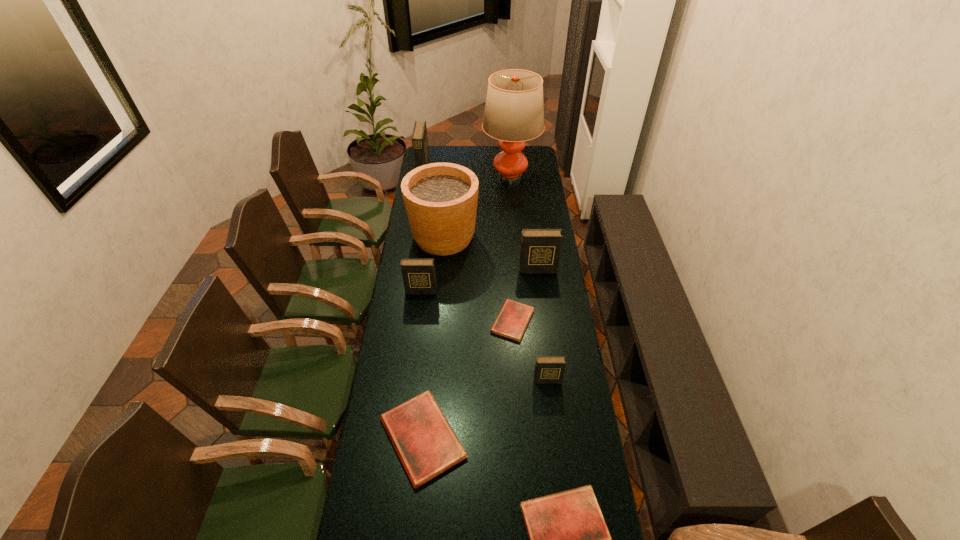
This screenshot has width=960, height=540. What are the coordinates of `the second closest object to the third farthest object` in the screenshot? It's located at (540, 251).

Locate which diary ranks fifth in proximity to the sixth shortest diary. Please provide its 2D coordinates. Your answer should be formatted as a tuple, i.e. [(x, y)], where the tuple contains the x and y coordinates of a point satisfying the conditions above.

[(419, 137)]

In order to click on diary that stands as the fourth closest to the flowerpot in this screenshot , I will do `click(419, 137)`.

Select which dark diary appears as the second closest to the fourth farthest diary. Please provide its 2D coordinates. Your answer should be formatted as a tuple, i.e. [(x, y)], where the tuple contains the x and y coordinates of a point satisfying the conditions above.

[(540, 251)]

Select which dark diary appears as the second closest to the flowerpot. Please provide its 2D coordinates. Your answer should be formatted as a tuple, i.e. [(x, y)], where the tuple contains the x and y coordinates of a point satisfying the conditions above.

[(540, 251)]

Find the location of a particular element. This screenshot has height=540, width=960. the third closest red diary to the orange lamp is located at coordinates (568, 537).

Identify which red diary is the closest to the seventh nearest object. Please provide its 2D coordinates. Your answer should be formatted as a tuple, i.e. [(x, y)], where the tuple contains the x and y coordinates of a point satisfying the conditions above.

[(511, 322)]

You are a GUI agent. You are given a task and a screenshot of the screen. Output one action in this format:
    pyautogui.click(x=<x>, y=<y>)
    Task: Click on the vacant space that satisfies the following two spatial constraints: 1. on the back side of the shortest diary; 2. on the front cover of the biggest dark diary
    
    Given the screenshot: What is the action you would take?
    pyautogui.click(x=503, y=172)

Where is `free region that satisfies the following two spatial constraints: 1. on the back side of the seventh tallest object; 2. on the left side of the orange lamp`? The height and width of the screenshot is (540, 960). free region that satisfies the following two spatial constraints: 1. on the back side of the seventh tallest object; 2. on the left side of the orange lamp is located at coordinates (447, 176).

Where is `free location that satisfies the following two spatial constraints: 1. on the front cover of the farthest dark diary; 2. on the right side of the smallest red diary`? This screenshot has width=960, height=540. free location that satisfies the following two spatial constraints: 1. on the front cover of the farthest dark diary; 2. on the right side of the smallest red diary is located at coordinates (399, 321).